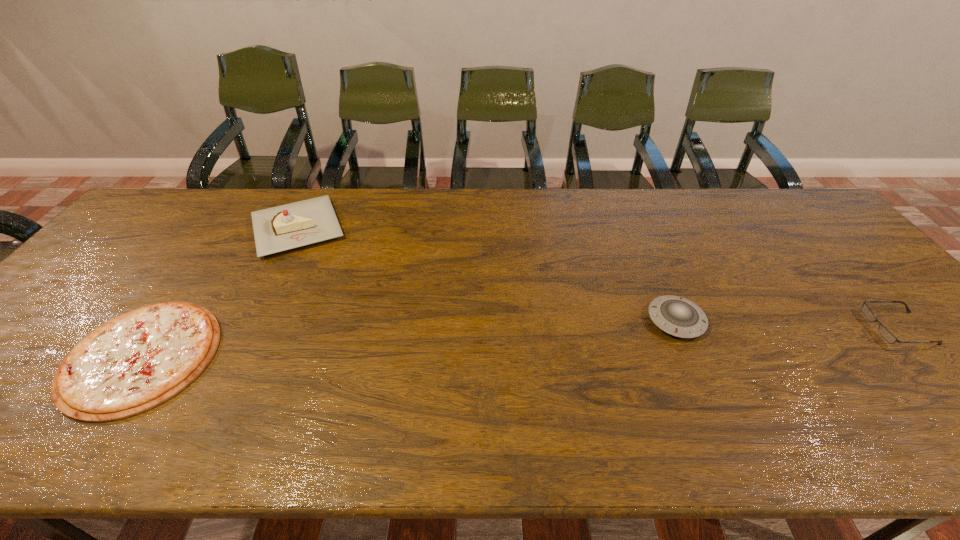
What are the coordinates of `free space at the left edge of the desktop` in the screenshot? It's located at (7, 382).

Find the location of a particular element. Image resolution: width=960 pixels, height=540 pixels. vacant space at the right edge of the desktop is located at coordinates (852, 248).

Identify the location of free space at the far left corner of the desktop. Image resolution: width=960 pixels, height=540 pixels. (174, 207).

Where is `vacant space at the far right corner`? The height and width of the screenshot is (540, 960). vacant space at the far right corner is located at coordinates (781, 216).

You are a GUI agent. You are given a task and a screenshot of the screen. Output one action in this format:
    pyautogui.click(x=<x>, y=<y>)
    Task: Click on the vacant area that lies between the saucer and the farthest object
    This screenshot has height=540, width=960.
    Given the screenshot: What is the action you would take?
    487,274

Locate an element on the screen. vacant space that is in between the second object from right to left and the tallest object is located at coordinates (487, 274).

You are a GUI agent. You are given a task and a screenshot of the screen. Output one action in this format:
    pyautogui.click(x=<x>, y=<y>)
    Task: Click on the free space between the shortest object and the tallest object
    This screenshot has width=960, height=540.
    Given the screenshot: What is the action you would take?
    pyautogui.click(x=220, y=292)

Image resolution: width=960 pixels, height=540 pixels. I want to click on empty location between the spectacles and the shortest object, so click(520, 342).

The height and width of the screenshot is (540, 960). I want to click on free point between the tallest object and the second tallest object, so click(x=487, y=274).

Find the location of `free space between the tallest object and the second shortest object`. free space between the tallest object and the second shortest object is located at coordinates (598, 278).